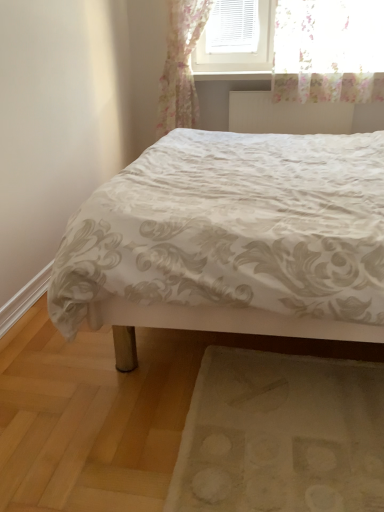
The width and height of the screenshot is (384, 512). I want to click on vacant space underneath beige fabric mat at lower right (from a real-world perspective), so click(288, 461).